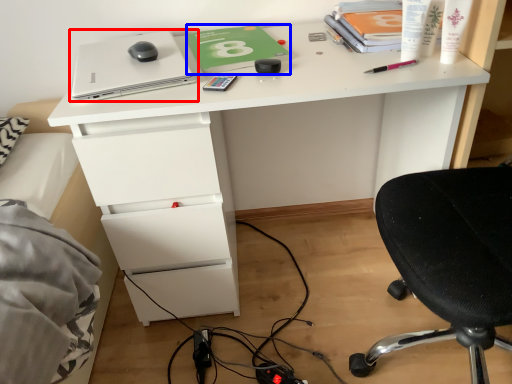
Question: Which point is closer to the camera, laptop (highlighted by a red box) or notebook (highlighted by a blue box)?

Choices:
 (A) laptop
 (B) notebook

Answer: (A)